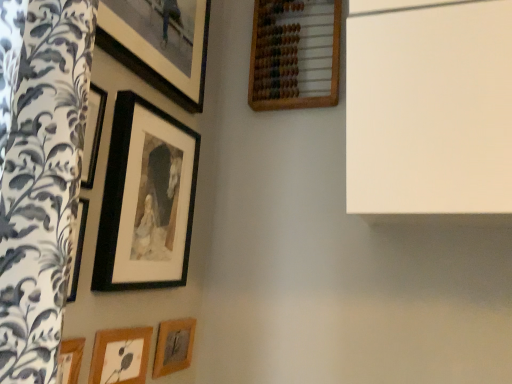
Question: From a real-world perspective, is wooden picture frame at lower center, marked as the fourth picture frame in a left-to-right arrangement, positioned over black matte picture frame at upper left, marked as the second picture frame in a left-to-right arrangement, based on gravity?

Choices:
 (A) yes
 (B) no

Answer: (B)

Question: Is black matte picture frame at upper left, marked as the second picture frame in a left-to-right arrangement, a part of wooden picture frame at lower center, acting as the second picture frame starting from the right?

Choices:
 (A) yes
 (B) no

Answer: (B)

Question: Would you say wooden picture frame at lower center, marked as the fourth picture frame in a left-to-right arrangement, is outside black matte picture frame at upper left, the fourth picture frame from the right?

Choices:
 (A) yes
 (B) no

Answer: (A)

Question: Does wooden picture frame at lower center, marked as the fourth picture frame in a left-to-right arrangement, have a lesser height compared to black matte picture frame at upper left, the fourth picture frame from the right?

Choices:
 (A) no
 (B) yes

Answer: (B)

Question: Considering the relative sizes of wooden picture frame at lower center, acting as the second picture frame starting from the right, and black matte picture frame at upper left, marked as the second picture frame in a left-to-right arrangement, in the image provided, is wooden picture frame at lower center, acting as the second picture frame starting from the right, smaller than black matte picture frame at upper left, marked as the second picture frame in a left-to-right arrangement,?

Choices:
 (A) no
 (B) yes

Answer: (B)

Question: From the image's perspective, is black matte picture frame at upper left, marked as the second picture frame in a left-to-right arrangement, located above or below wooden picture frame at lower center, marked as the fourth picture frame in a left-to-right arrangement?

Choices:
 (A) below
 (B) above

Answer: (B)

Question: Is black matte picture frame at upper left, marked as the second picture frame in a left-to-right arrangement, taller or shorter than wooden picture frame at lower center, acting as the second picture frame starting from the right?

Choices:
 (A) short
 (B) tall

Answer: (B)

Question: Considering the positions of point (156, 137) and point (183, 334), is point (156, 137) closer or farther from the camera than point (183, 334)?

Choices:
 (A) farther
 (B) closer

Answer: (B)

Question: In the image, is black matte picture frame at upper left, marked as the second picture frame in a left-to-right arrangement, on the left side or the right side of wooden picture frame at lower center, marked as the fourth picture frame in a left-to-right arrangement?

Choices:
 (A) left
 (B) right

Answer: (A)

Question: Considering the positions of point (318, 44) and point (132, 248), is point (318, 44) closer or farther from the camera than point (132, 248)?

Choices:
 (A) farther
 (B) closer

Answer: (A)

Question: In terms of width, does wooden abacus at upper center, placed as the 5th picture frame when sorted from left to right, look wider or thinner when compared to black matte picture frame at upper left, the fourth picture frame from the right?

Choices:
 (A) wide
 (B) thin

Answer: (A)

Question: Would you say wooden abacus at upper center, the 1th picture frame viewed from the right, is inside or outside black matte picture frame at upper left, marked as the second picture frame in a left-to-right arrangement?

Choices:
 (A) outside
 (B) inside

Answer: (A)

Question: From the image's perspective, is wooden abacus at upper center, placed as the 5th picture frame when sorted from left to right, located above or below black matte picture frame at upper left, marked as the second picture frame in a left-to-right arrangement?

Choices:
 (A) above
 (B) below

Answer: (A)

Question: Is wooden picture frame at lower center, marked as the fourth picture frame in a left-to-right arrangement, situated inside matte black picture frame at upper left, the 3th picture frame positioned from the left, or outside?

Choices:
 (A) inside
 (B) outside

Answer: (B)

Question: From a real-world perspective, is wooden picture frame at lower center, marked as the fourth picture frame in a left-to-right arrangement, above or below matte black picture frame at upper left, the 3th picture frame positioned from the left?

Choices:
 (A) above
 (B) below

Answer: (B)